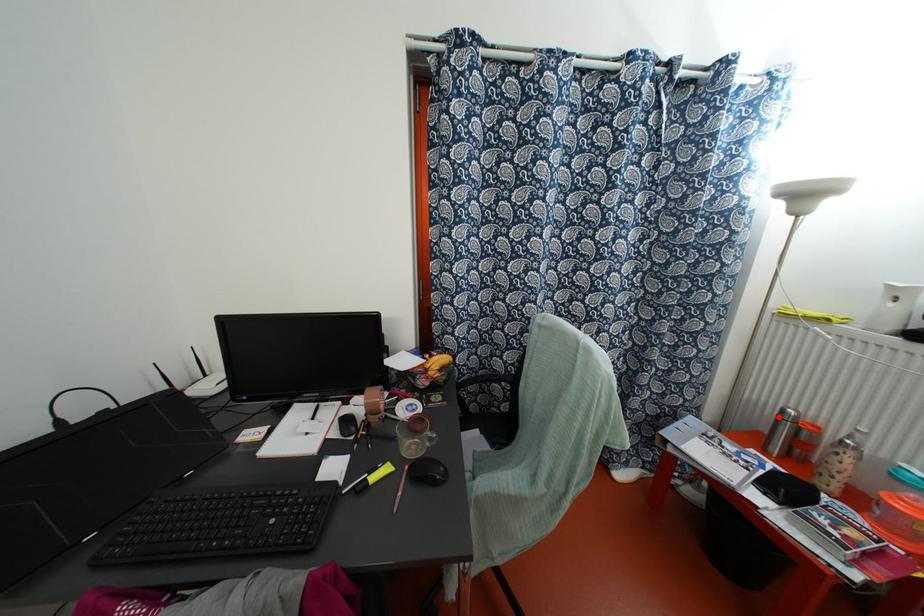
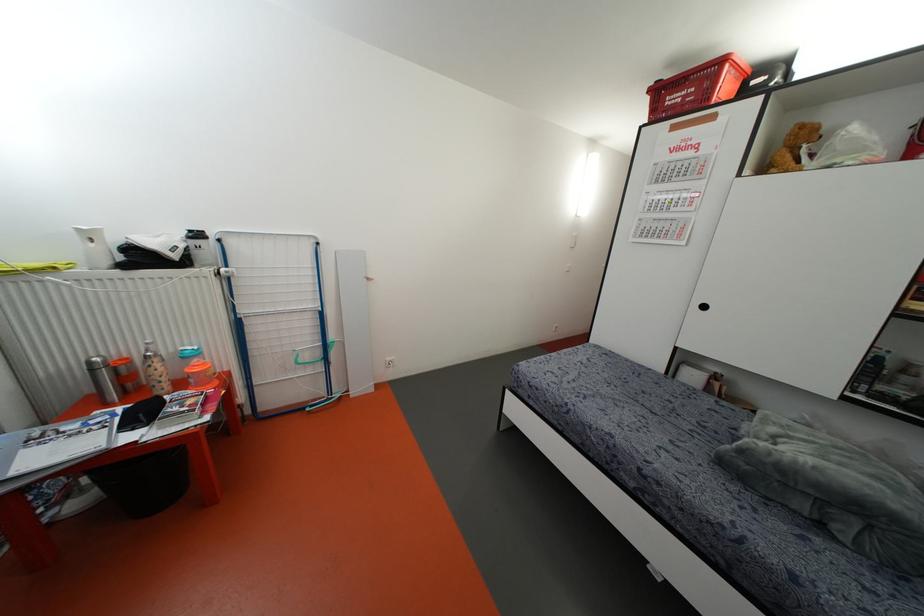
The point at the highlighted location is marked in the first image. Where is the corresponding point in the second image?

(91, 370)